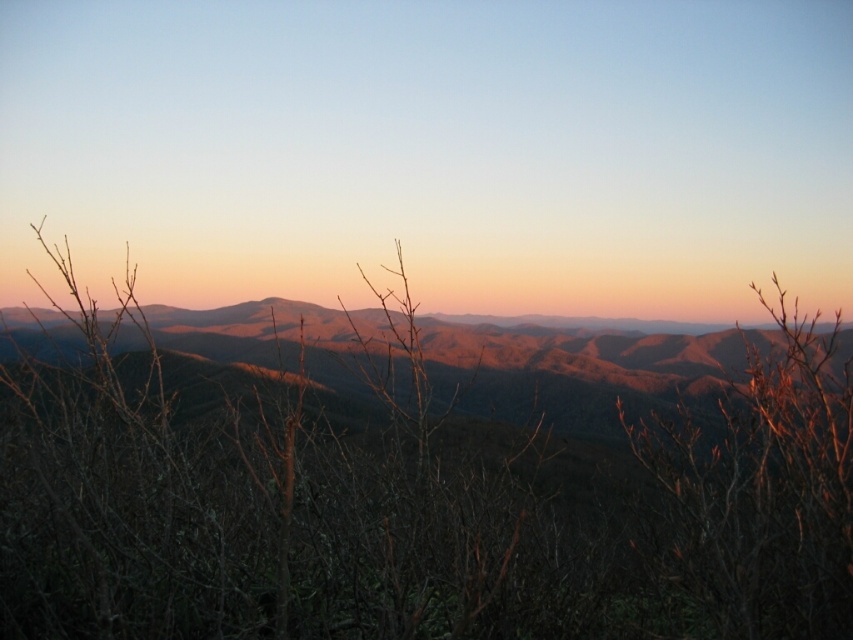
Question: Is brown dry branches at center below brown matte mountain range at center?

Choices:
 (A) no
 (B) yes

Answer: (B)

Question: Which point is farther from the camera taking this photo?

Choices:
 (A) (132, 312)
 (B) (556, 364)

Answer: (B)

Question: Considering the relative positions of brown dry branches at center and brown matte mountain range at center in the image provided, where is brown dry branches at center located with respect to brown matte mountain range at center?

Choices:
 (A) left
 (B) right

Answer: (B)

Question: Is the position of brown dry branches at center more distant than that of brown matte mountain range at center?

Choices:
 (A) yes
 (B) no

Answer: (B)